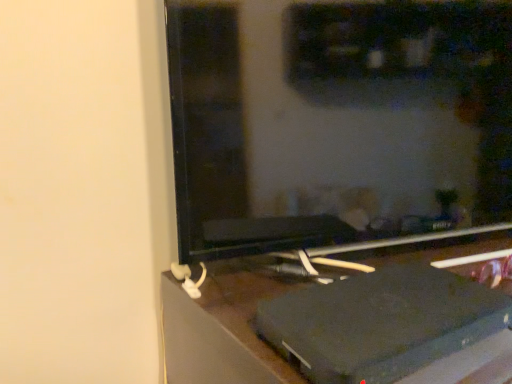
Question: Could black plastic laptop at lower right be considered to be inside black matte computer monitor at center?

Choices:
 (A) yes
 (B) no

Answer: (B)

Question: Is black matte computer monitor at center outside of black plastic laptop at lower right?

Choices:
 (A) yes
 (B) no

Answer: (A)

Question: From the image's perspective, is black matte computer monitor at center on top of black plastic laptop at lower right?

Choices:
 (A) no
 (B) yes

Answer: (B)

Question: Does black matte computer monitor at center touch black plastic laptop at lower right?

Choices:
 (A) yes
 (B) no

Answer: (B)

Question: Would you consider black matte computer monitor at center to be distant from black plastic laptop at lower right?

Choices:
 (A) no
 (B) yes

Answer: (A)

Question: From a real-world perspective, is black matte computer monitor at center under black plastic laptop at lower right?

Choices:
 (A) no
 (B) yes

Answer: (A)

Question: Can you confirm if black plastic laptop at lower right is taller than black matte computer monitor at center?

Choices:
 (A) no
 (B) yes

Answer: (B)

Question: From a real-world perspective, is black plastic laptop at lower right physically below black matte computer monitor at center?

Choices:
 (A) no
 (B) yes

Answer: (B)

Question: From the image's perspective, is black plastic laptop at lower right over black matte computer monitor at center?

Choices:
 (A) no
 (B) yes

Answer: (A)

Question: Is black plastic laptop at lower right completely or partially outside of black matte computer monitor at center?

Choices:
 (A) no
 (B) yes

Answer: (B)

Question: From a real-world perspective, does black plastic laptop at lower right stand above black matte computer monitor at center?

Choices:
 (A) no
 (B) yes

Answer: (A)

Question: Is the position of black plastic laptop at lower right more distant than that of black matte computer monitor at center?

Choices:
 (A) yes
 (B) no

Answer: (B)

Question: In terms of width, does black matte computer monitor at center look wider or thinner when compared to black plastic laptop at lower right?

Choices:
 (A) thin
 (B) wide

Answer: (A)